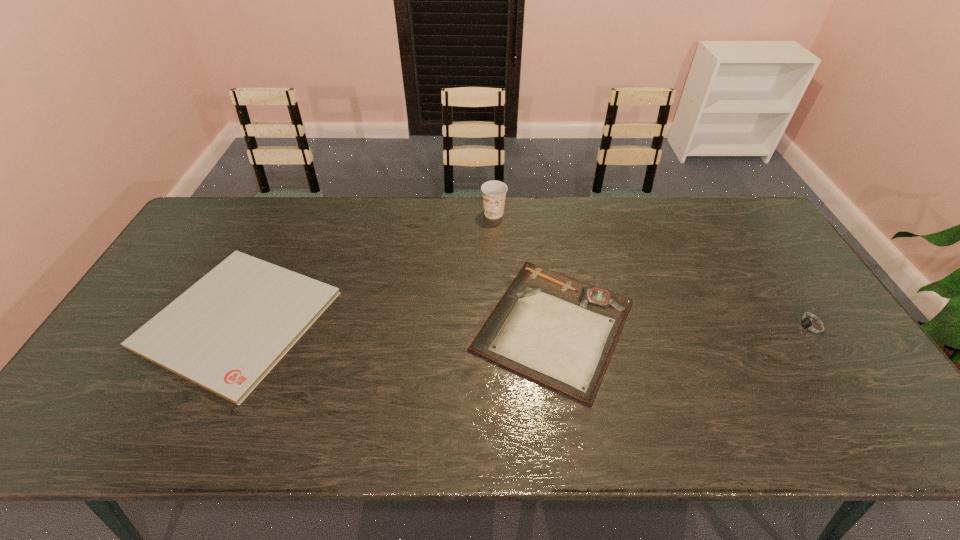
Find the location of `Dixie cup`. Dixie cup is located at coordinates (493, 192).

The height and width of the screenshot is (540, 960). Find the location of `the farthest object`. the farthest object is located at coordinates [x=493, y=192].

The height and width of the screenshot is (540, 960). I want to click on the third shortest object, so click(809, 325).

Image resolution: width=960 pixels, height=540 pixels. Identify the location of watch. (809, 325).

You are a GUI agent. You are given a task and a screenshot of the screen. Output one action in this format:
    pyautogui.click(x=<x>, y=<y>)
    Task: Click on the right clipboard
    This screenshot has height=540, width=960.
    Given the screenshot: What is the action you would take?
    pyautogui.click(x=559, y=331)

Locate an element on the screen. the leftmost object is located at coordinates (225, 333).

Find the location of a particular element. vacant region located 0.280m on the left of the Dixie cup is located at coordinates (400, 213).

Where is `free region located 0.310m on the face of the second tallest object`? This screenshot has width=960, height=540. free region located 0.310m on the face of the second tallest object is located at coordinates (675, 327).

Where is `vacant space located 0.400m on the face of the second tallest object`? The width and height of the screenshot is (960, 540). vacant space located 0.400m on the face of the second tallest object is located at coordinates (641, 327).

What are the coordinates of `blank area located on the face of the second tallest object` in the screenshot? It's located at (727, 327).